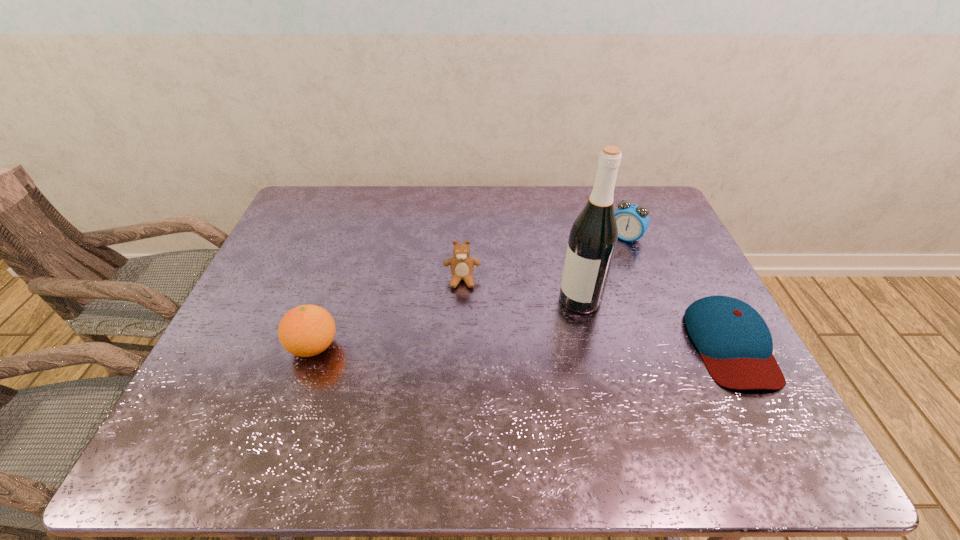
Locate an element on the screen. free space that satisfies the following two spatial constraints: 1. on the back side of the leftmost object; 2. on the right side of the alarm clock is located at coordinates (351, 237).

This screenshot has height=540, width=960. I want to click on free space that satisfies the following two spatial constraints: 1. on the back side of the orange; 2. on the left side of the wine bottle, so click(330, 300).